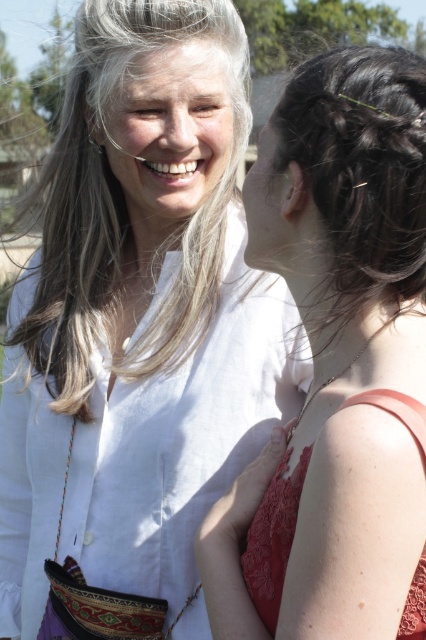
Question: Among these objects, which one is farthest from the camera?

Choices:
 (A) matte white blouse at upper left
 (B) lace coral dress at right

Answer: (B)

Question: Which point is closer to the camera?

Choices:
 (A) smooth white face at upper center
 (B) matte white blouse at upper left
 (C) dark brown textured hair at upper right
 (D) lace coral dress at right

Answer: (B)

Question: Is lace coral dress at right to the right of smooth skin face at center from the viewer's perspective?

Choices:
 (A) no
 (B) yes

Answer: (B)

Question: Is lace coral dress at right positioned behind smooth skin face at center?

Choices:
 (A) yes
 (B) no

Answer: (B)

Question: Considering the relative positions of matte white blouse at upper left and smooth skin face at center in the image provided, where is matte white blouse at upper left located with respect to smooth skin face at center?

Choices:
 (A) right
 (B) left

Answer: (A)

Question: Based on their relative distances, which object is farther from the lace coral dress at right?

Choices:
 (A) matte white blouse at upper left
 (B) matte skin nose at center
 (C) smooth skin face at center
 (D) white cotton shirt at upper left

Answer: (B)